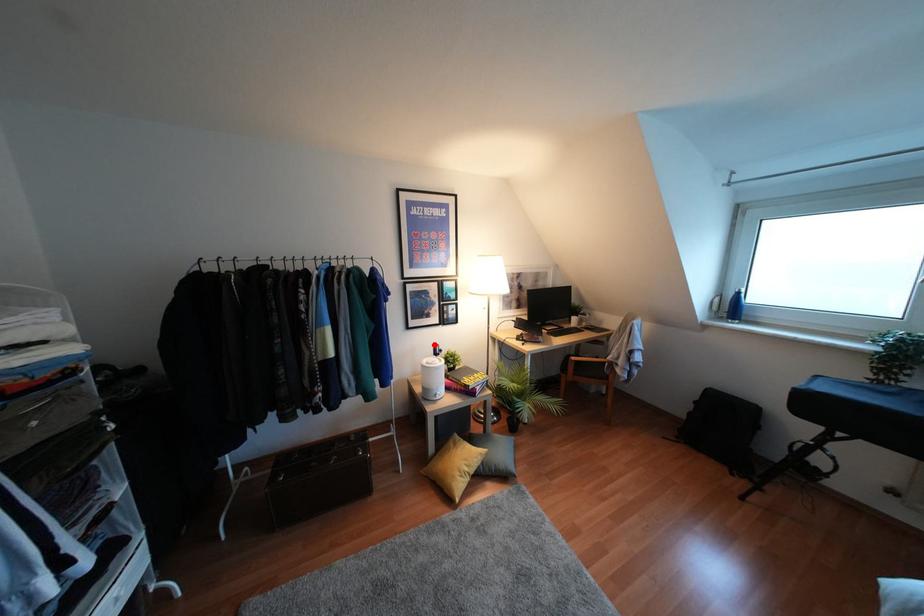
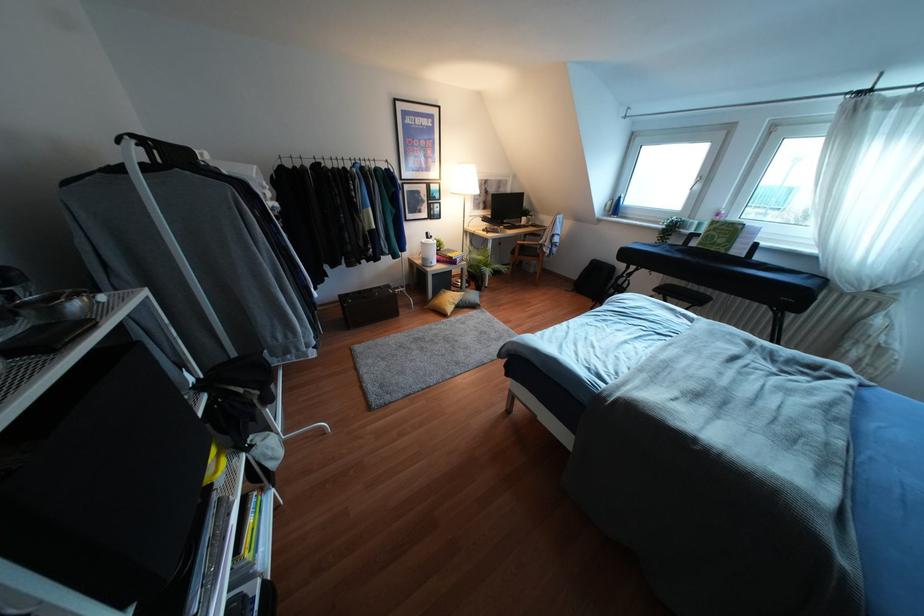
Question: I am providing you with two images of the same scene from different viewpoints. A red point is shown in image1. For the corresponding object point in image2, is it positioned nearer or farther from the camera?

Choices:
 (A) Nearer
 (B) Farther

Answer: (A)